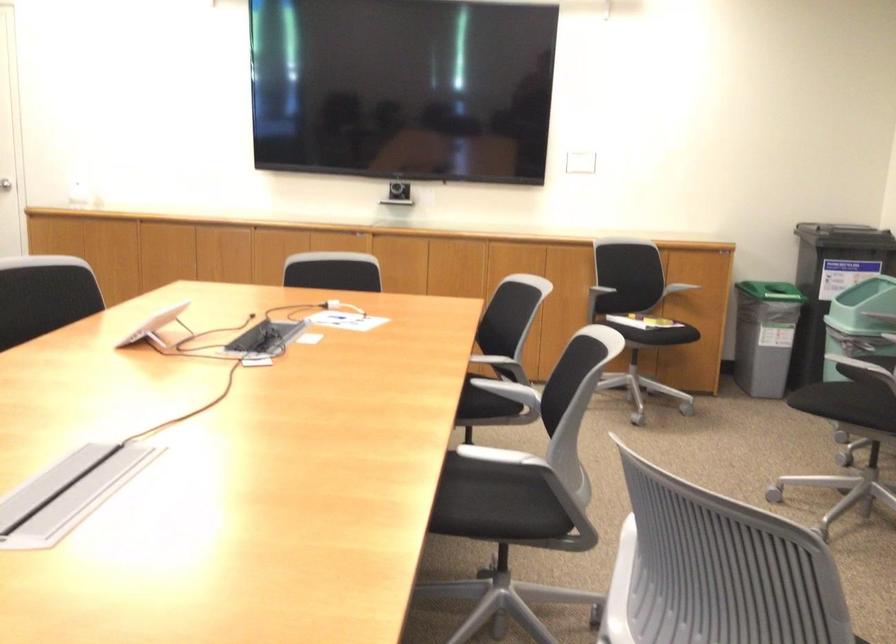
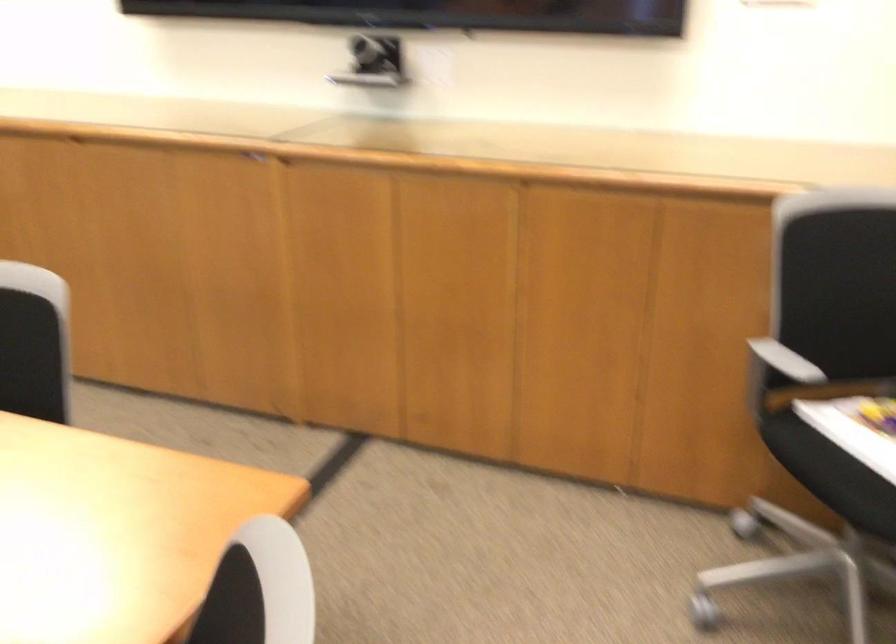
Find the pixel in the second image that matches (x=626, y=303) in the first image.

(857, 442)